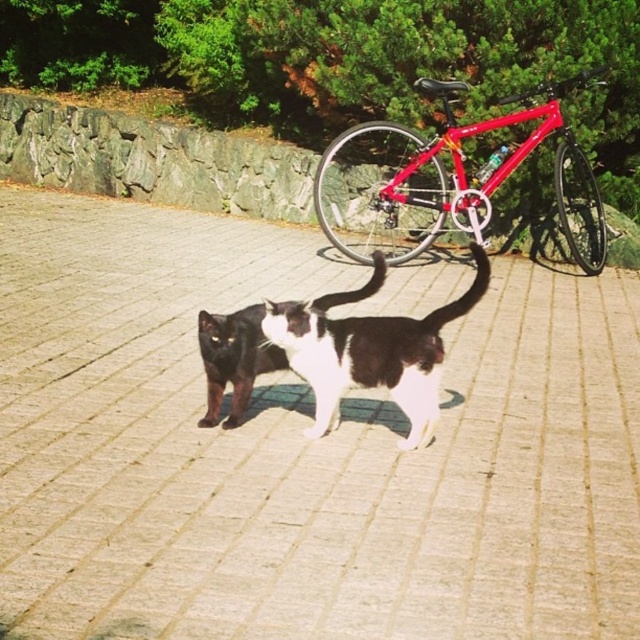
You are a delivery person who needs to park your metallic bicycle at upper right and red glossy bicycle at center in this paved area. The parking space has a height restriction of 1.2 meters. Can both bicycles be parked there?

The metallic bicycle at upper right has a lesser height compared to red glossy bicycle at center. Since the height restriction is 1.2 meters, we need to check the height of both bicycles. However, the exact heights are not provided. But since the metallic bicycle is shorter than the red one, if the red bicycle is under 1.2 meters, both can be parked. If the red one exceeds, only the metallic one can be parked.

You are a photographer trying to capture a photo of the white fur cat at center and the brick pavement at center. Which object should you focus on first if you want to include both in the frame without moving the camera?

The brick pavement at center is bigger than the white fur cat at center, so you should focus on the brick pavement at center first to ensure it fills more of the frame appropriately while still including the cat.